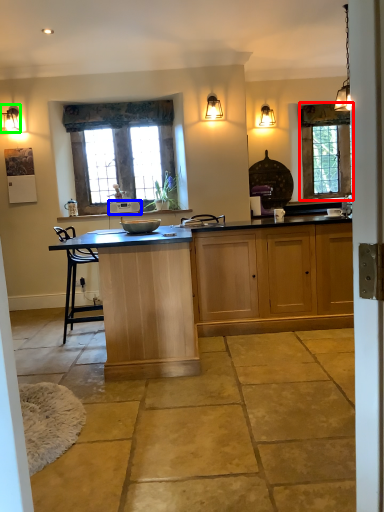
Question: Estimate the real-world distances between objects in this image. Which object is closer to window (highlighted by a red box), kitchen appliance (highlighted by a blue box) or lamp (highlighted by a green box)?

Choices:
 (A) kitchen appliance
 (B) lamp

Answer: (A)